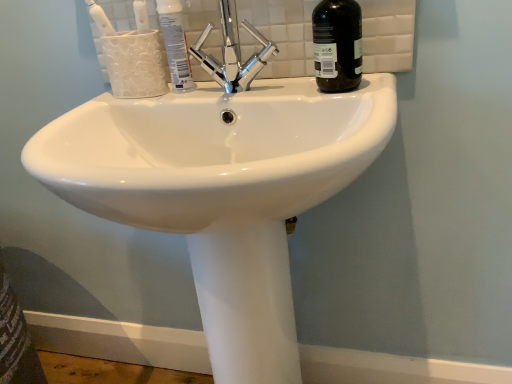
Describe the element at coordinates (175, 45) in the screenshot. This screenshot has width=512, height=384. I see `white glossy toothpaste at upper center` at that location.

In order to face white glossy toothbrush at upper left, should I rotate leftwards or rightwards?

Rotate your view left by about 20.964°.

Measure the distance between black glass bottle at upper right and camera.

black glass bottle at upper right is 25.07 inches away from camera.

You are a GUI agent. You are given a task and a screenshot of the screen. Output one action in this format:
    pyautogui.click(x=<x>, y=<y>)
    Task: Click on the black glass bottle at upper right
    Image resolution: width=512 pixels, height=384 pixels.
    Given the screenshot: What is the action you would take?
    pyautogui.click(x=337, y=45)

The height and width of the screenshot is (384, 512). I want to click on white glossy toothpaste at upper center, so click(x=175, y=45).

Between point (211, 55) and point (95, 124), which one is positioned in front?

The point (95, 124) is closer.

Identify the location of tap behind the white glossy sink at center. (233, 52).

Is polished chrome faucet at upper center at the left side of white glossy sink at center?

Yes.

From a real-world perspective, which object stands above the other?

polished chrome faucet at upper center, from a real-world perspective.

Is black glass bottle at upper right bigger than white glossy sink at center?

Actually, black glass bottle at upper right might be smaller than white glossy sink at center.

Based on the photo, from the image's perspective, is black glass bottle at upper right below white glossy sink at center?

No.

Can you confirm if white glossy sink at center is thinner than white glossy toothpaste at upper center?

Incorrect, the width of white glossy sink at center is not less than that of white glossy toothpaste at upper center.

Does white glossy sink at center have a smaller size compared to white glossy toothpaste at upper center?

No.

Which is more to the left, white glossy sink at center or white glossy toothpaste at upper center?

white glossy toothpaste at upper center.

Is white glossy toothpaste at upper center at the right side of white glossy toothbrush at upper left?

Correct, you'll find white glossy toothpaste at upper center to the right of white glossy toothbrush at upper left.

Is white glossy toothpaste at upper center closer to the viewer compared to white glossy toothbrush at upper left?

No, the depth of white glossy toothpaste at upper center is greater than that of white glossy toothbrush at upper left.

Can you tell me how much white glossy toothpaste at upper center and white glossy toothbrush at upper left differ in facing direction?

12 degrees.

From the image's perspective, who appears lower, white glossy toothpaste at upper center or polished chrome faucet at upper center?

polished chrome faucet at upper center is shown below in the image.

Considering the sizes of white glossy toothpaste at upper center and polished chrome faucet at upper center in the image, is white glossy toothpaste at upper center bigger or smaller than polished chrome faucet at upper center?

white glossy toothpaste at upper center is smaller than polished chrome faucet at upper center.

Is white glossy toothpaste at upper center in contact with polished chrome faucet at upper center?

Yes, white glossy toothpaste at upper center is in contact with polished chrome faucet at upper center.

Locate an element on the screen. mouthwash below the polished chrome faucet at upper center (from a real-world perspective) is located at coordinates (175, 45).

Considering the relative positions of white glossy toothbrush at upper left and black glass bottle at upper right in the image provided, is white glossy toothbrush at upper left in front of black glass bottle at upper right?

No, it is not.

How different are the orientations of white glossy toothbrush at upper left and black glass bottle at upper right in degrees?

There is a 6.13-degree angle between the facing directions of white glossy toothbrush at upper left and black glass bottle at upper right.

Are white glossy toothbrush at upper left and black glass bottle at upper right located far from each other?

white glossy toothbrush at upper left is near black glass bottle at upper right, not far away.

From a real-world perspective, is white glossy toothbrush at upper left below black glass bottle at upper right?

Actually, white glossy toothbrush at upper left is physically above black glass bottle at upper right in the real world.

Is white glossy sink at center in contact with white glossy toothbrush at upper left?

They are not placed beside each other.

Does point (241, 350) come closer to viewer compared to point (104, 32)?

Yes, point (241, 350) is in front of point (104, 32).

Between white glossy sink at center and white glossy toothbrush at upper left, which one has smaller width?

white glossy toothbrush at upper left.

Image resolution: width=512 pixels, height=384 pixels. Identify the location of sink below the polished chrome faucet at upper center (from the image's perspective). (222, 191).

In the image, there is a black glass bottle at upper right. What are the coordinates of `sink below it (from a real-world perspective)` in the screenshot? It's located at (222, 191).

Looking at the image, which one is located further to white glossy toothpaste at upper center, polished chrome faucet at upper center or white glossy toothbrush at upper left?

white glossy toothbrush at upper left.

Based on their spatial positions, is white glossy sink at center or white glossy toothpaste at upper center closer to polished chrome faucet at upper center?

The object closer to polished chrome faucet at upper center is white glossy toothpaste at upper center.

Considering their positions, is white glossy sink at center positioned closer to polished chrome faucet at upper center than black glass bottle at upper right?

black glass bottle at upper right is closer to polished chrome faucet at upper center.

From the image, which object appears to be farther from white glossy toothpaste at upper center, black glass bottle at upper right or white glossy sink at center?

Among the two, white glossy sink at center is located further to white glossy toothpaste at upper center.

Estimate the real-world distances between objects in this image. Which object is closer to polished chrome faucet at upper center, white glossy toothpaste at upper center or white glossy toothbrush at upper left?

white glossy toothpaste at upper center is positioned closer to the anchor polished chrome faucet at upper center.

Considering their positions, is white glossy toothpaste at upper center positioned closer to polished chrome faucet at upper center than black glass bottle at upper right?

Based on the image, white glossy toothpaste at upper center appears to be nearer to polished chrome faucet at upper center.

From the image, which object appears to be farther from white glossy toothpaste at upper center, white glossy sink at center or polished chrome faucet at upper center?

Among the two, white glossy sink at center is located further to white glossy toothpaste at upper center.

When comparing their distances from polished chrome faucet at upper center, does white glossy toothbrush at upper left or white glossy sink at center seem further?

Among the two, white glossy sink at center is located further to polished chrome faucet at upper center.

Locate an element on the screen. tap between white glossy toothbrush at upper left and black glass bottle at upper right in the horizontal direction is located at coordinates (233, 52).

Identify the location of mouthwash between white glossy toothbrush at upper left and polished chrome faucet at upper center. The width and height of the screenshot is (512, 384). (175, 45).

This screenshot has height=384, width=512. What are the coordinates of `bottle between white glossy toothbrush at upper left and white glossy sink at center vertically` in the screenshot? It's located at (337, 45).

The width and height of the screenshot is (512, 384). Identify the location of tap between black glass bottle at upper right and white glossy sink at center in the vertical direction. (233, 52).